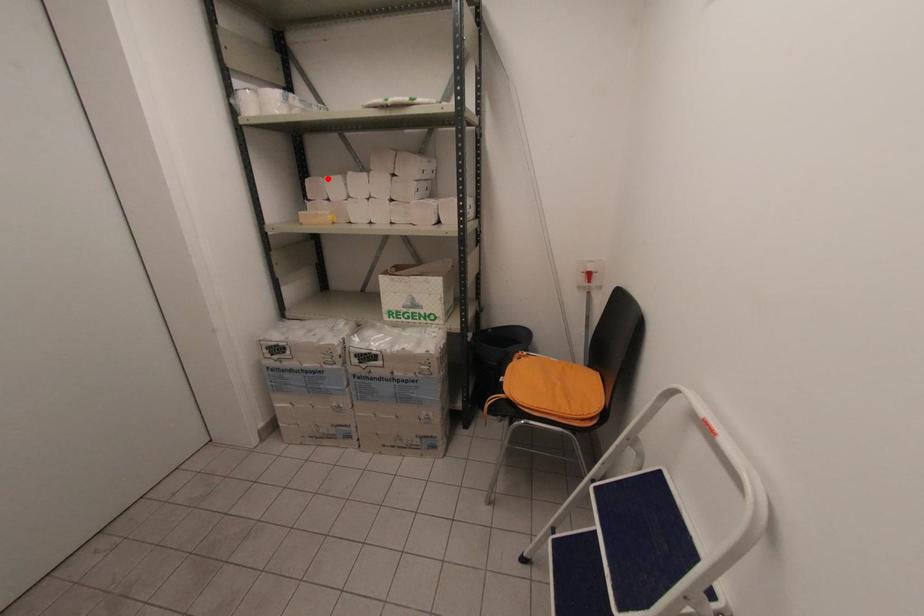
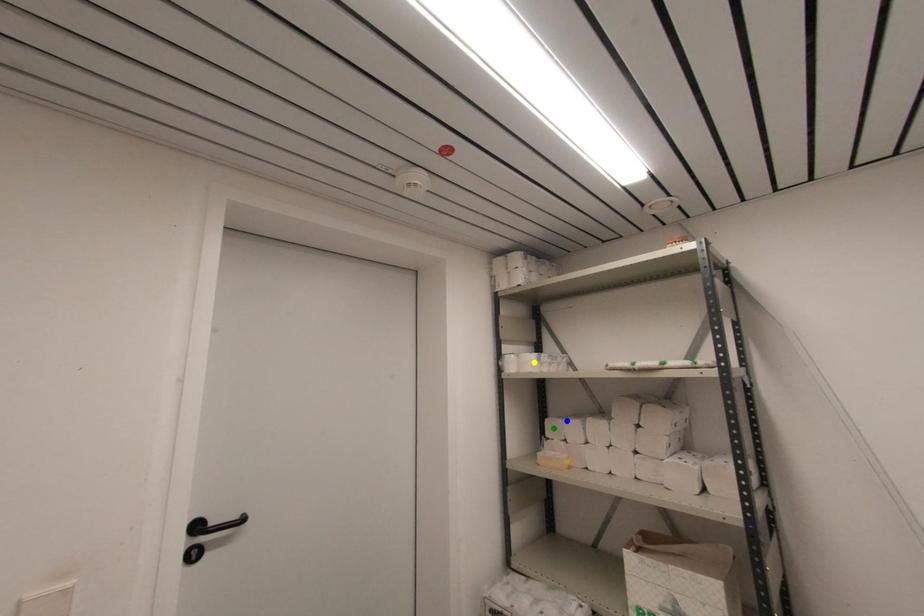
Question: I am providing you with two images of the same scene from different viewpoints. A red point is marked on the first image. You are given multiple points on the second image. Which point in image 2 is actually the same real-world point as the red point in image 1?

Choices:
 (A) yellow point
 (B) blue point
 (C) green point

Answer: (B)